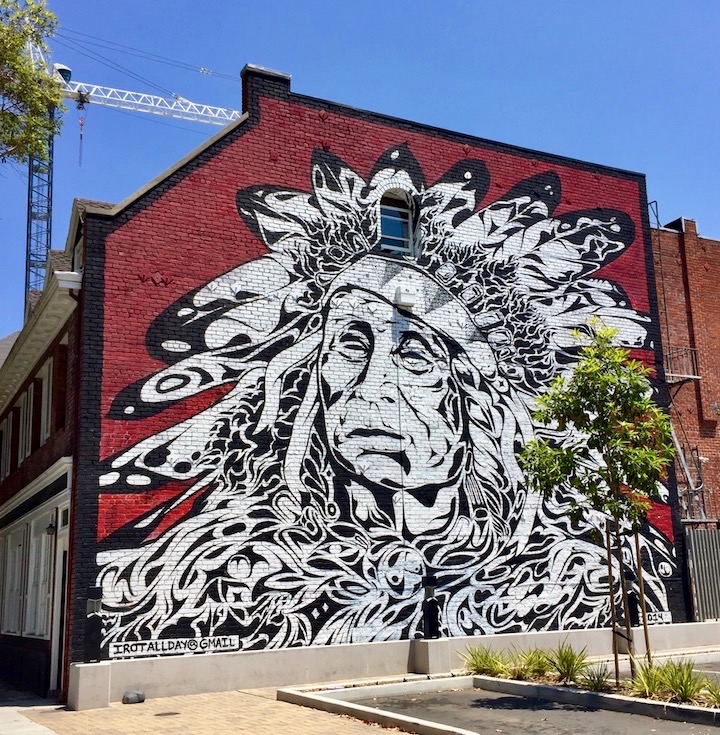
Image resolution: width=720 pixels, height=735 pixels. What are the coordinates of `wall` in the screenshot? It's located at (171, 414).